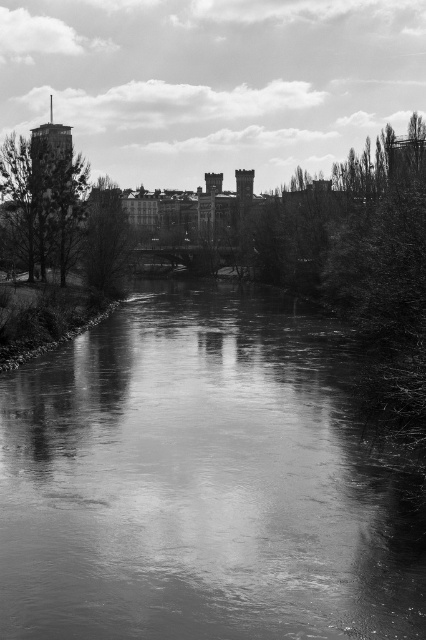
Question: Does smooth water at center lie behind smooth bark tree at left?

Choices:
 (A) yes
 (B) no

Answer: (B)

Question: Which of the following is the closest to the observer?

Choices:
 (A) smooth bark tree at left
 (B) dark green leafy tree at center

Answer: (A)

Question: Can you confirm if smooth water at center is positioned to the left of dark green leafy tree at center?

Choices:
 (A) yes
 (B) no

Answer: (B)

Question: Is smooth water at center behind dark green leafy tree at center?

Choices:
 (A) no
 (B) yes

Answer: (A)

Question: Which point is closer to the camera taking this photo?

Choices:
 (A) (31, 216)
 (B) (209, 582)

Answer: (B)

Question: Which point is farther to the camera?

Choices:
 (A) smooth bark tree at left
 (B) dark green leafy tree at center

Answer: (B)